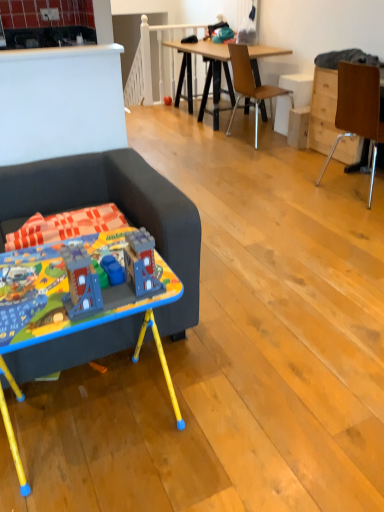
In order to click on vacant space in front of wooden chair at right, which is counted as the second chair, starting from the left in this screenshot , I will do `click(350, 220)`.